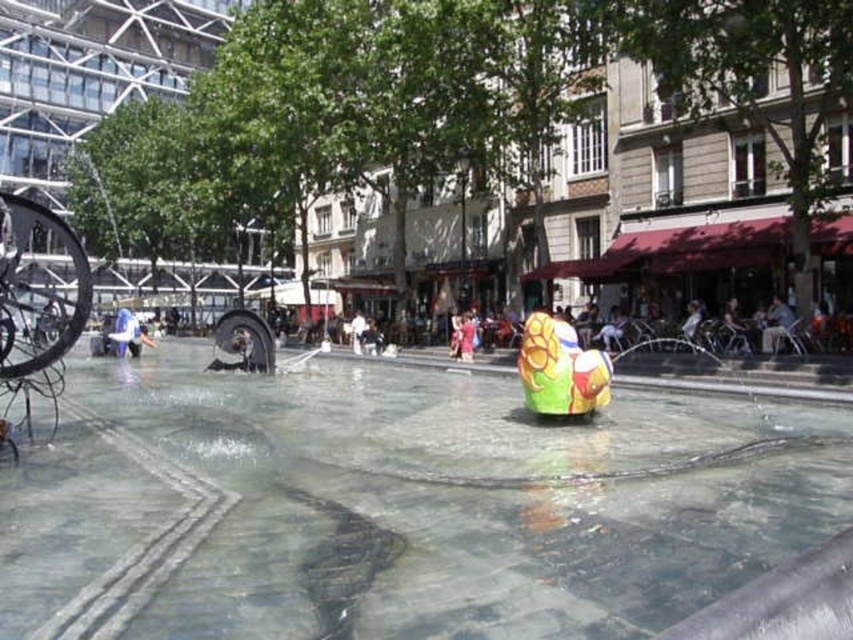
How far apart are clear glass water at center and glossy plastic toy at center?

clear glass water at center and glossy plastic toy at center are 18.79 feet apart from each other.

Can you confirm if clear glass water at center is bigger than glossy plastic toy at center?

Indeed, clear glass water at center has a larger size compared to glossy plastic toy at center.

Is point (575, 515) positioned before point (521, 336)?

Yes.

Where is `clear glass water at center`? Image resolution: width=853 pixels, height=640 pixels. clear glass water at center is located at coordinates (395, 506).

Does clear glass water at center appear under matte pink dress at center?

Correct, clear glass water at center is located below matte pink dress at center.

Can you confirm if clear glass water at center is smaller than matte pink dress at center?

Actually, clear glass water at center might be larger than matte pink dress at center.

I want to click on clear glass water at center, so click(395, 506).

Locate an element on the screen. clear glass water at center is located at coordinates (395, 506).

Which is more to the left, glossy plastic toy at center or matte pink dress at center?

matte pink dress at center is more to the left.

Can you confirm if glossy plastic toy at center is thinner than matte pink dress at center?

No.

Where is `glossy plastic toy at center`? glossy plastic toy at center is located at coordinates (560, 369).